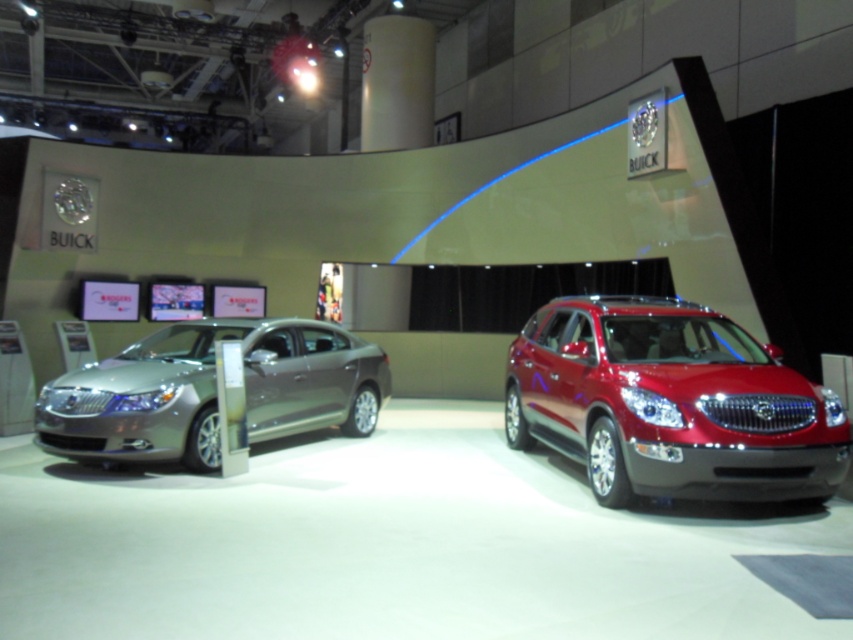
You are a customer standing in the showroom and want to see the glossy red suv at center. However, the satin silver sedan at left is blocking your view. Can you move around the sedan to get a clear view of the SUV?

The glossy red suv at center is positioned under the satin silver sedan at left, meaning the sedan is directly in front of or above the SUV. To get a clear view of the SUV, you would need to move around the sedan to either side or behind it, as the SUV is located beneath the sedan in the display.

You are standing in the car showroom and want to move from the point marked at coordinates point (648,300) to the point marked at coordinates point (241,332). Can you walk directly between these two points without any obstacles?

Point (648,300) is in front of point (241,332), so there is no obstruction between them. You can walk directly between these two points without any obstacles.

You are a delivery person who needs to place a 10 feet long crate between the glossy red suv at center and the satin silver sedan at left. Is there enough space between them to fit the crate?

The distance between the glossy red suv at center and the satin silver sedan at left is 12.13 feet, which is longer than the 10 feet length of the crate. Therefore, there is sufficient space to place the crate between them.